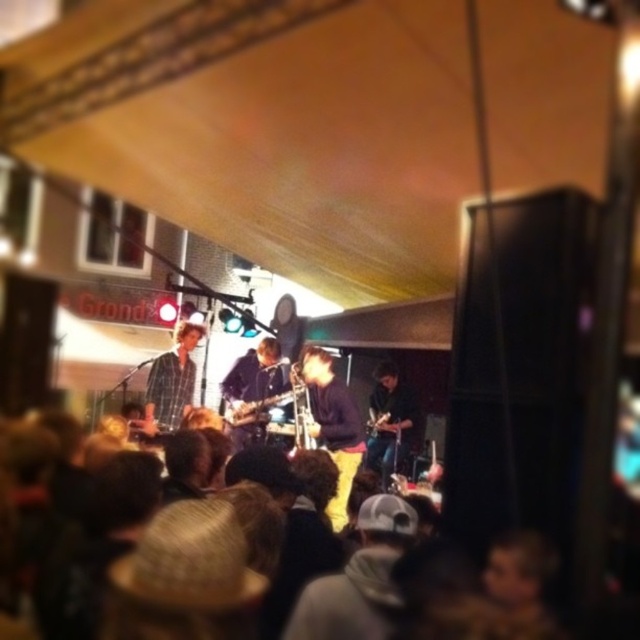
You are an audience member sitting in the front row of the concert. You notice two items of clothing on the stage. The first is the matte yellow pants at center, and the second is the plaid shirt at center. Which clothing item is positioned lower on the performer?

The matte yellow pants at center are located below the plaid shirt at center, so the matte yellow pants at center are positioned lower on the performer.